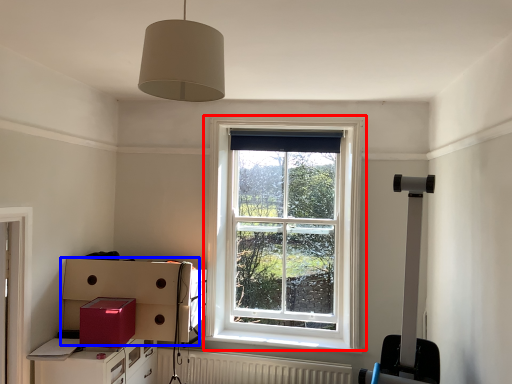
Question: Which object appears farthest to the camera in this image, window (highlighted by a red box) or cardboard box (highlighted by a blue box)?

Choices:
 (A) window
 (B) cardboard box

Answer: (A)